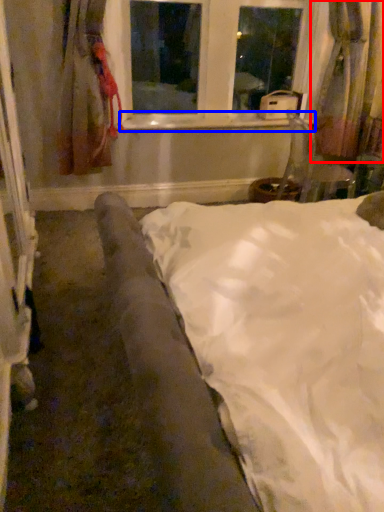
Question: Which object appears farthest to the camera in this image, curtain (highlighted by a red box) or window sill (highlighted by a blue box)?

Choices:
 (A) curtain
 (B) window sill

Answer: (B)